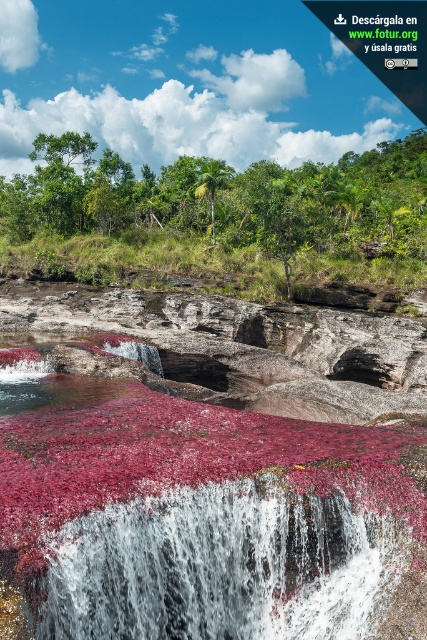
Question: Among these points, which one is farthest from the camera?

Choices:
 (A) (56, 227)
 (B) (335, 502)

Answer: (A)

Question: Which point is farther to the camera?

Choices:
 (A) green leafy trees at center
 (B) white frothy water at center

Answer: (A)

Question: Is white frothy water at center wider than green leafy trees at center?

Choices:
 (A) no
 (B) yes

Answer: (A)

Question: Is white frothy water at center behind green leafy trees at center?

Choices:
 (A) yes
 (B) no

Answer: (B)

Question: Is white frothy water at center smaller than green leafy trees at center?

Choices:
 (A) yes
 (B) no

Answer: (A)